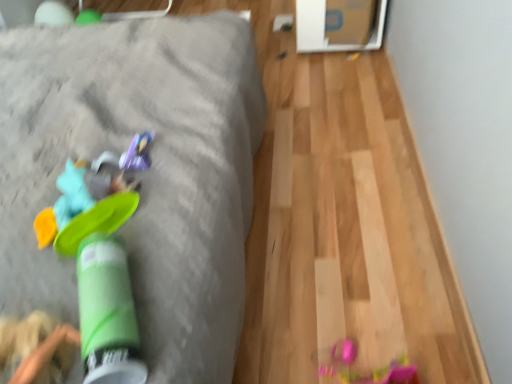
Locate an element on the screen. The image size is (512, 384). rubberized green frisbee at left, which ranks as the first toy in front-to-back order is located at coordinates (91, 200).

How much distance is there between rubberized green frisbee at left, marked as the 2th toy in a back-to-front arrangement, and green plastic cup at left?

The distance of rubberized green frisbee at left, marked as the 2th toy in a back-to-front arrangement, from green plastic cup at left is 9.54 inches.

Is rubberized green frisbee at left, marked as the 2th toy in a back-to-front arrangement, in front of or behind green plastic cup at left in the image?

rubberized green frisbee at left, marked as the 2th toy in a back-to-front arrangement, is positioned closer to the viewer than green plastic cup at left.

From a real-world perspective, between rubberized green frisbee at left, marked as the 2th toy in a back-to-front arrangement, and green plastic cup at left, who is vertically higher?

rubberized green frisbee at left, marked as the 2th toy in a back-to-front arrangement, from a real-world perspective.

Is rubberized green frisbee at left, which ranks as the first toy in front-to-back order, facing towards green plastic cup at left?

No.

Is rubberized green frisbee at left, which ranks as the first toy in front-to-back order, located within shiny purple toy at center, which appears as the second toy when viewed from the front?

That's incorrect, rubberized green frisbee at left, which ranks as the first toy in front-to-back order, is not inside shiny purple toy at center, which appears as the second toy when viewed from the front.

Between shiny purple toy at center, which appears as the second toy when viewed from the front, and rubberized green frisbee at left, which ranks as the first toy in front-to-back order, which one appears on the right side from the viewer's perspective?

shiny purple toy at center, which appears as the second toy when viewed from the front.

Based on the photo, can you confirm if shiny purple toy at center, which appears as the second toy when viewed from the front, is taller than rubberized green frisbee at left, which ranks as the first toy in front-to-back order?

Incorrect, the height of shiny purple toy at center, which appears as the second toy when viewed from the front, is not larger of that of rubberized green frisbee at left, which ranks as the first toy in front-to-back order.

Is shiny purple toy at center, which appears as the second toy when viewed from the front, turned away from rubberized green frisbee at left, which ranks as the first toy in front-to-back order?

Yes, rubberized green frisbee at left, which ranks as the first toy in front-to-back order, is at the back of shiny purple toy at center, which appears as the second toy when viewed from the front.

At what (x,y) coordinates should I click in order to perform the action: click on furniture lying behind the shiny purple toy at center, which appears as the second toy when viewed from the front. Please return your answer as a coordinate pair (x, y). The height and width of the screenshot is (384, 512). Looking at the image, I should click on (139, 173).

Is the depth of shiny purple toy at center, the first toy viewed from the back, greater than that of green plastic cup at left?

No, shiny purple toy at center, the first toy viewed from the back, is closer to the camera.

Would you say shiny purple toy at center, the first toy viewed from the back, is outside green plastic cup at left?

Indeed, shiny purple toy at center, the first toy viewed from the back, is completely outside green plastic cup at left.

From a real-world perspective, is shiny purple toy at center, the first toy viewed from the back, beneath green plastic cup at left?

Actually, shiny purple toy at center, the first toy viewed from the back, is physically above green plastic cup at left in the real world.

Can you confirm if rubberized green frisbee at left, which ranks as the first toy in front-to-back order, is shorter than shiny purple toy at center, the first toy viewed from the back?

No.

From a real-world perspective, is rubberized green frisbee at left, which ranks as the first toy in front-to-back order, physically above shiny purple toy at center, which appears as the second toy when viewed from the front?

Indeed, from a real-world perspective, rubberized green frisbee at left, which ranks as the first toy in front-to-back order, stands above shiny purple toy at center, which appears as the second toy when viewed from the front.

Is shiny purple toy at center, which appears as the second toy when viewed from the front, completely or partially inside rubberized green frisbee at left, marked as the 2th toy in a back-to-front arrangement?

No.

Which is behind, point (111, 227) or point (147, 138)?

Positioned behind is point (147, 138).

Is green plastic cup at left aimed at rubberized green frisbee at left, which ranks as the first toy in front-to-back order?

No, green plastic cup at left is not facing towards rubberized green frisbee at left, which ranks as the first toy in front-to-back order.

Which is more to the right, green plastic cup at left or rubberized green frisbee at left, which ranks as the first toy in front-to-back order?

Positioned to the right is green plastic cup at left.

From a real-world perspective, is green plastic cup at left located higher than rubberized green frisbee at left, which ranks as the first toy in front-to-back order?

Actually, green plastic cup at left is physically below rubberized green frisbee at left, which ranks as the first toy in front-to-back order, in the real world.

Which is correct: green plastic cup at left is inside shiny purple toy at center, the first toy viewed from the back, or outside of it?

green plastic cup at left is located beyond the bounds of shiny purple toy at center, the first toy viewed from the back.

How many degrees apart are the facing directions of green plastic cup at left and shiny purple toy at center, which appears as the second toy when viewed from the front?

There is a 26.8-degree angle between the facing directions of green plastic cup at left and shiny purple toy at center, which appears as the second toy when viewed from the front.

From the image's perspective, which is above, green plastic cup at left or shiny purple toy at center, the first toy viewed from the back?

From the image's view, green plastic cup at left is above.

Is green plastic cup at left turned away from shiny purple toy at center, which appears as the second toy when viewed from the front?

No, green plastic cup at left is not facing away from shiny purple toy at center, which appears as the second toy when viewed from the front.

The image size is (512, 384). Find the location of `toy that is the 2nd one when counting downward from the green plastic cup at left (from the image's perspective)`. toy that is the 2nd one when counting downward from the green plastic cup at left (from the image's perspective) is located at coordinates (91, 200).

Find the location of a particular element. toy in front of the shiny purple toy at center, which appears as the second toy when viewed from the front is located at coordinates (91, 200).

From the image, which object appears to be nearer to green plastic cup at left, rubberized green frisbee at left, which ranks as the first toy in front-to-back order, or shiny purple toy at center, the first toy viewed from the back?

rubberized green frisbee at left, which ranks as the first toy in front-to-back order, lies closer to green plastic cup at left than the other object.

When comparing their distances from shiny purple toy at center, the first toy viewed from the back, does green plastic cup at left or rubberized green frisbee at left, marked as the 2th toy in a back-to-front arrangement, seem closer?

Among the two, rubberized green frisbee at left, marked as the 2th toy in a back-to-front arrangement, is located nearer to shiny purple toy at center, the first toy viewed from the back.

Estimate the real-world distances between objects in this image. Which object is further from green plastic cup at left, shiny purple toy at center, the first toy viewed from the back, or rubberized green frisbee at left, marked as the 2th toy in a back-to-front arrangement?

Among the two, shiny purple toy at center, the first toy viewed from the back, is located further to green plastic cup at left.

Looking at the image, which one is located further to rubberized green frisbee at left, marked as the 2th toy in a back-to-front arrangement, green plastic cup at left or shiny purple toy at center, the first toy viewed from the back?

green plastic cup at left lies further to rubberized green frisbee at left, marked as the 2th toy in a back-to-front arrangement, than the other object.

Based on their spatial positions, is rubberized green frisbee at left, marked as the 2th toy in a back-to-front arrangement, or green plastic cup at left further from shiny purple toy at center, the first toy viewed from the back?

The object further to shiny purple toy at center, the first toy viewed from the back, is green plastic cup at left.

Considering their positions, is shiny purple toy at center, which appears as the second toy when viewed from the front, positioned further to rubberized green frisbee at left, which ranks as the first toy in front-to-back order, than green plastic cup at left?

Among the two, green plastic cup at left is located further to rubberized green frisbee at left, which ranks as the first toy in front-to-back order.

I want to click on toy between green plastic cup at left and rubberized green frisbee at left, which ranks as the first toy in front-to-back order, from top to bottom, so click(x=137, y=153).